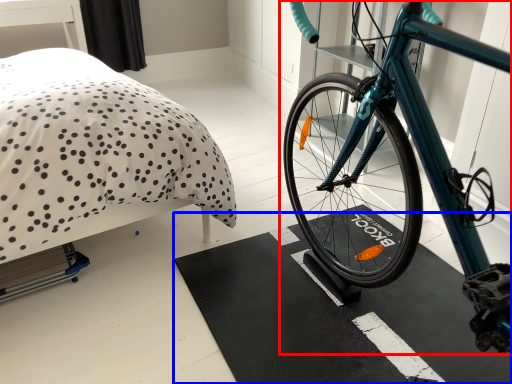
Question: Which object appears closest to the camera in this image, bicycle (highlighted by a red box) or bath mat (highlighted by a blue box)?

Choices:
 (A) bicycle
 (B) bath mat

Answer: (A)